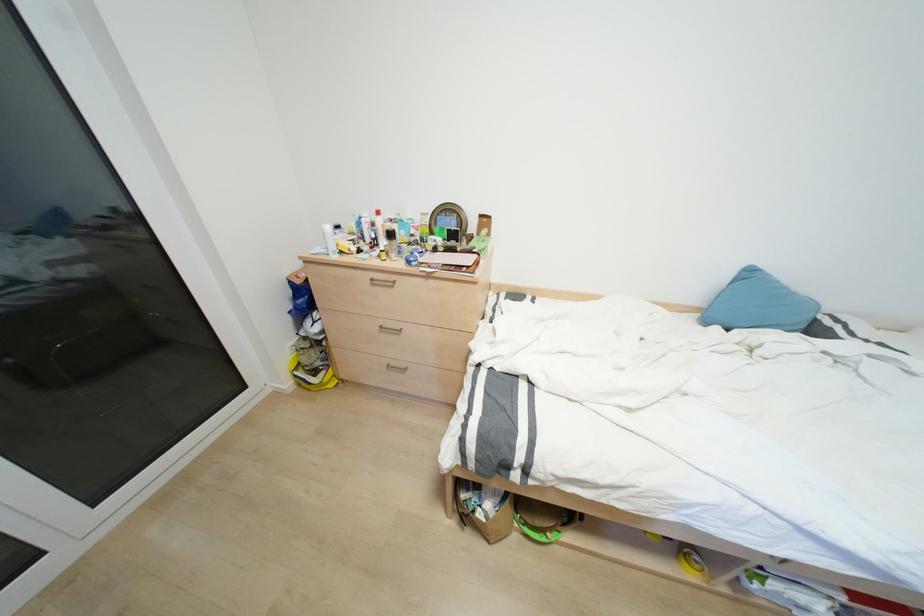
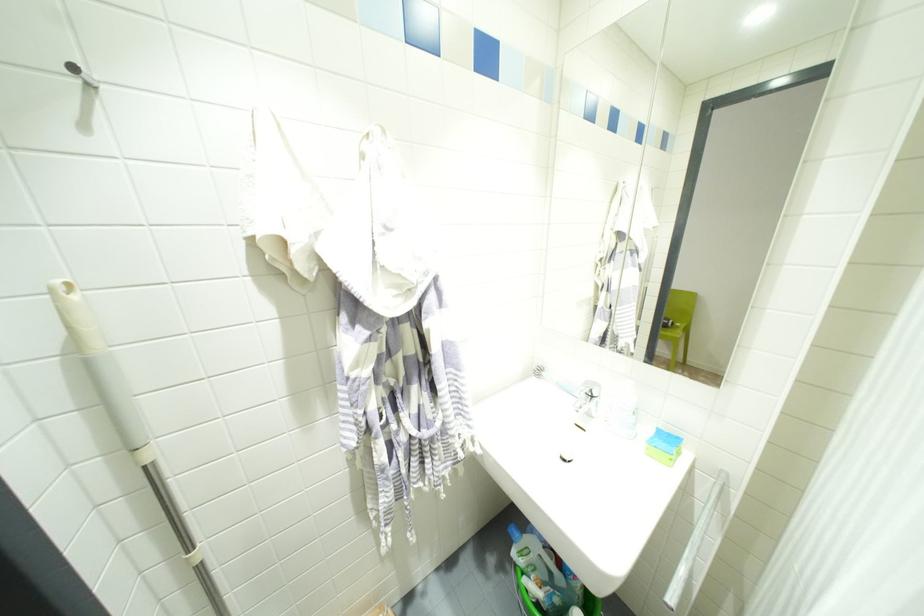
Question: I am providing you with two images of the same scene from different viewpoints. Please identify which objects are invisible in image2.

Choices:
 (A) round coaster
 (B) metal wall hook
 (C) cardboard box
 (D) white cleaning bottle

Answer: (C)